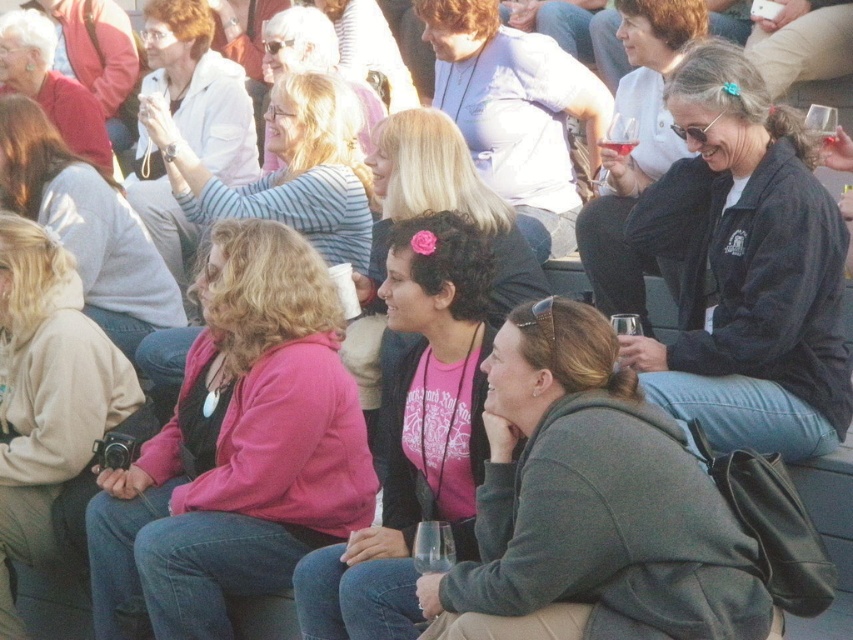
Which is more to the left, pink fabric shirt at center or matte black jacket at center?

From the viewer's perspective, pink fabric shirt at center appears more on the left side.

Where is `pink fabric shirt at center`? This screenshot has width=853, height=640. pink fabric shirt at center is located at coordinates (415, 435).

Does striped fabric shirt at center have a lesser width compared to clear glass wine at center?

In fact, striped fabric shirt at center might be wider than clear glass wine at center.

How much distance is there between striped fabric shirt at center and clear glass wine at center?

A distance of 6.54 meters exists between striped fabric shirt at center and clear glass wine at center.

This screenshot has height=640, width=853. Identify the location of striped fabric shirt at center. (314, 58).

Image resolution: width=853 pixels, height=640 pixels. Find the location of `striped fabric shirt at center`. striped fabric shirt at center is located at coordinates (314, 58).

Which is more to the left, pink fleece jacket at center or beige fleece sweatshirt at lower left?

beige fleece sweatshirt at lower left

Between pink fleece jacket at center and beige fleece sweatshirt at lower left, which one has less height?

With less height is pink fleece jacket at center.

At what (x,y) coordinates should I click in order to perform the action: click on pink fleece jacket at center. Please return your answer as a coordinate pair (x, y). This screenshot has height=640, width=853. Looking at the image, I should click on (236, 451).